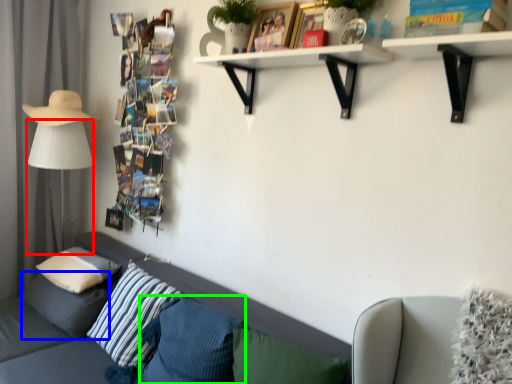
Question: Which is farther away from table lamp (highlighted by a red box)? pillow (highlighted by a blue box) or pillow (highlighted by a green box)?

Choices:
 (A) pillow
 (B) pillow

Answer: (B)